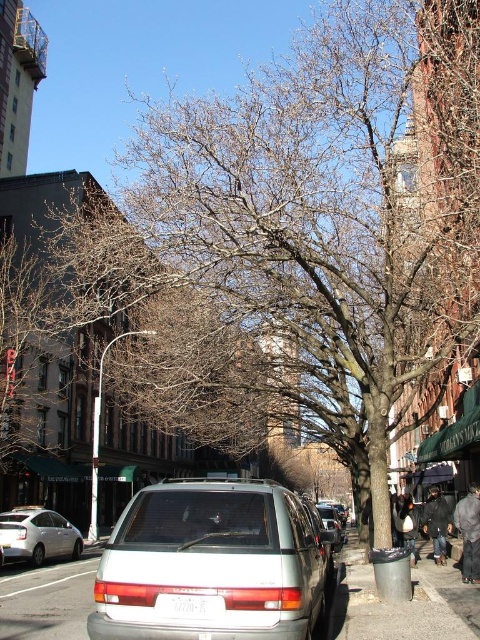
Is point (444, 556) less distant than point (336, 512)?

That is True.

Can you confirm if black leather jacket at lower right is bigger than matte silver van at center?

No, black leather jacket at lower right is not bigger than matte silver van at center.

Which is behind, point (435, 516) or point (342, 534)?

The point (342, 534) is more distant.

You are a GUI agent. You are given a task and a screenshot of the screen. Output one action in this format:
    pyautogui.click(x=<x>, y=<y>)
    Task: Click on the black leather jacket at lower right
    This screenshot has height=640, width=480.
    Given the screenshot: What is the action you would take?
    pyautogui.click(x=436, y=524)

Does gray asphalt pavement at lower center have a lesser width compared to black leather jacket at lower right?

No.

Who is taller, gray asphalt pavement at lower center or black leather jacket at lower right?

gray asphalt pavement at lower center is taller.

Image resolution: width=480 pixels, height=640 pixels. Identify the location of gray asphalt pavement at lower center. (402, 604).

Is white matte van at center above gray asphalt pavement at lower center?

Correct, white matte van at center is located above gray asphalt pavement at lower center.

Which is in front, point (282, 589) or point (336, 602)?

Positioned in front is point (282, 589).

Locate an element on the screen. The image size is (480, 640). white matte van at center is located at coordinates (211, 563).

This screenshot has height=640, width=480. I want to click on white matte van at center, so click(211, 563).